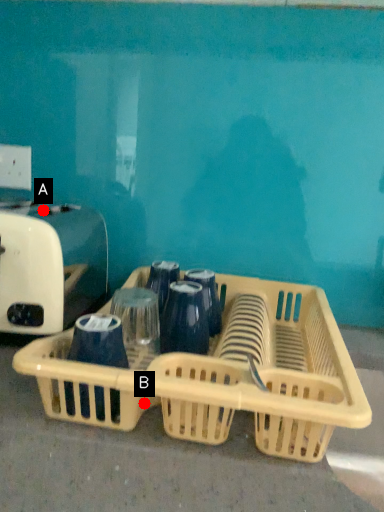
Question: Two points are circled on the image, labeled by A and B beside each circle. Which point is closer to the camera?

Choices:
 (A) A is closer
 (B) B is closer

Answer: (B)